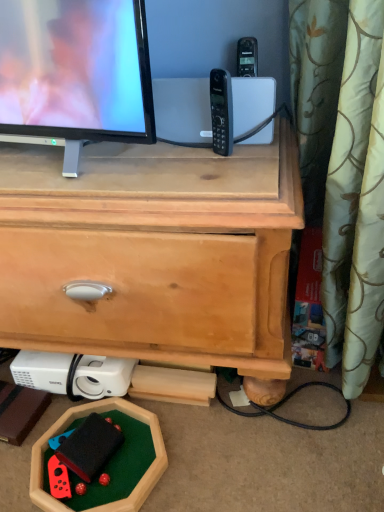
Locate an element on the screen. This screenshot has width=384, height=512. vacant area to the left of black plastic phone at center is located at coordinates pos(144,166).